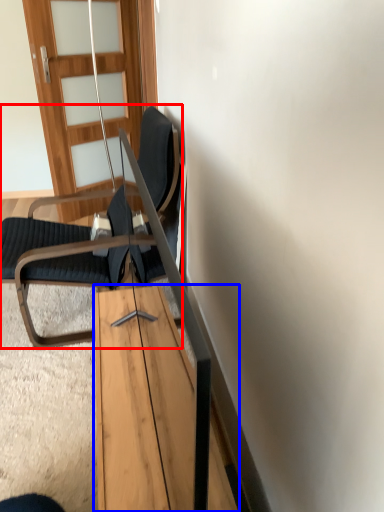
Question: Which object appears farthest to the camera in this image, chair (highlighted by a red box) or table (highlighted by a blue box)?

Choices:
 (A) chair
 (B) table

Answer: (A)